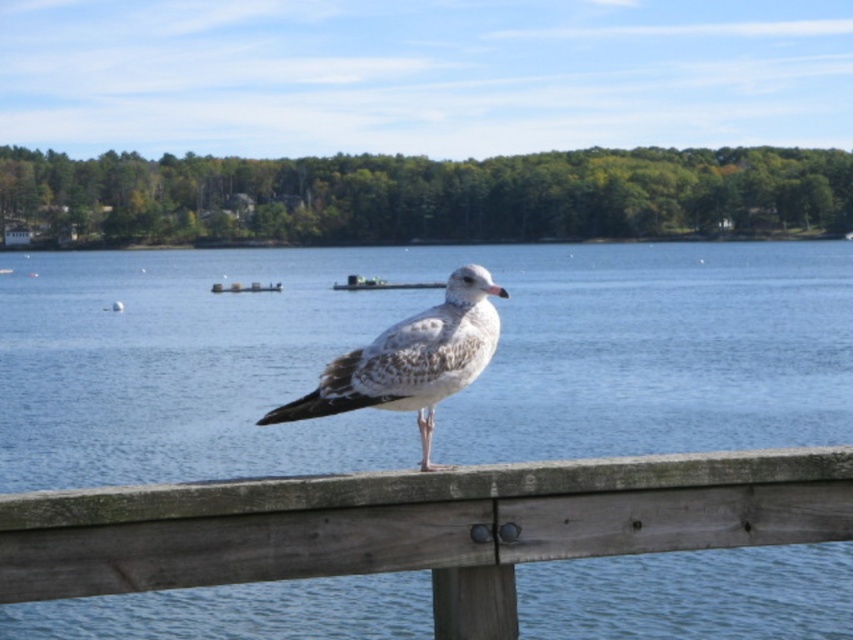
Which of these two, weathered wood rail at center or speckled feathered seagull at center, stands taller?

Standing taller between the two is speckled feathered seagull at center.

Based on the photo, between weathered wood rail at center and speckled feathered seagull at center, which one appears on the right side from the viewer's perspective?

Positioned to the right is weathered wood rail at center.

Between point (444, 604) and point (378, 392), which one is positioned in front?

Point (444, 604) is more forward.

What are the coordinates of `weathered wood rail at center` in the screenshot? It's located at (419, 525).

Can you confirm if blue water at center is positioned to the left of weathered wood rail at center?

Correct, you'll find blue water at center to the left of weathered wood rail at center.

Who is more forward, (764, 244) or (271, 529)?

Point (271, 529) is in front.

You are a GUI agent. You are given a task and a screenshot of the screen. Output one action in this format:
    pyautogui.click(x=<x>, y=<y>)
    Task: Click on the blue water at center
    This screenshot has width=853, height=640.
    Given the screenshot: What is the action you would take?
    pyautogui.click(x=392, y=323)

Locate an element on the screen. blue water at center is located at coordinates (392, 323).

This screenshot has width=853, height=640. In order to click on blue water at center in this screenshot , I will do `click(392, 323)`.

Is point (361, 632) farther from viewer compared to point (285, 410)?

That is True.

Is point (33, 312) positioned before point (320, 410)?

No, it is behind (320, 410).

Locate an element on the screen. The width and height of the screenshot is (853, 640). blue water at center is located at coordinates (392, 323).